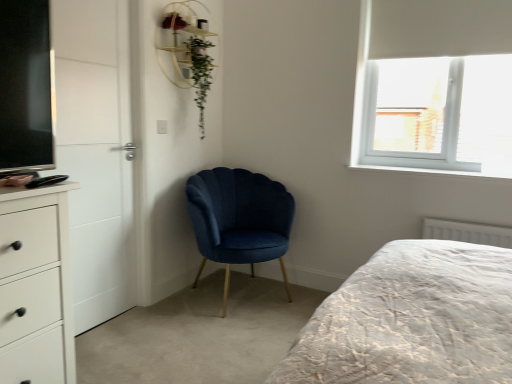
Question: Could you tell me if velvet blue chair at center is facing white matte chest of drawers at left?

Choices:
 (A) yes
 (B) no

Answer: (B)

Question: Is white matte chest of drawers at left at the back of velvet blue chair at center?

Choices:
 (A) yes
 (B) no

Answer: (B)

Question: From a real-world perspective, does velvet blue chair at center stand above white matte chest of drawers at left?

Choices:
 (A) no
 (B) yes

Answer: (A)

Question: Is the surface of velvet blue chair at center in direct contact with white matte chest of drawers at left?

Choices:
 (A) yes
 (B) no

Answer: (B)

Question: Is velvet blue chair at center in front of white matte chest of drawers at left?

Choices:
 (A) no
 (B) yes

Answer: (A)

Question: Is green leafy plant at upper center spatially inside white matte chest of drawers at left, or outside of it?

Choices:
 (A) outside
 (B) inside

Answer: (A)

Question: From a real-world perspective, is green leafy plant at upper center above or below white matte chest of drawers at left?

Choices:
 (A) below
 (B) above

Answer: (B)

Question: In terms of size, does green leafy plant at upper center appear bigger or smaller than white matte chest of drawers at left?

Choices:
 (A) big
 (B) small

Answer: (B)

Question: From the image's perspective, is green leafy plant at upper center located above or below white matte chest of drawers at left?

Choices:
 (A) above
 (B) below

Answer: (A)

Question: Relative to wooden shelf at upper center, is green leafy plant at upper center in front or behind?

Choices:
 (A) front
 (B) behind

Answer: (B)

Question: Is green leafy plant at upper center wider or thinner than wooden shelf at upper center?

Choices:
 (A) thin
 (B) wide

Answer: (B)

Question: In terms of height, does green leafy plant at upper center look taller or shorter compared to wooden shelf at upper center?

Choices:
 (A) short
 (B) tall

Answer: (B)

Question: Is point (211, 61) positioned closer to the camera than point (168, 11)?

Choices:
 (A) farther
 (B) closer

Answer: (A)

Question: Is velvet blue chair at center inside the boundaries of green leafy plant at upper center, or outside?

Choices:
 (A) outside
 (B) inside

Answer: (A)

Question: In terms of width, does velvet blue chair at center look wider or thinner when compared to green leafy plant at upper center?

Choices:
 (A) thin
 (B) wide

Answer: (B)